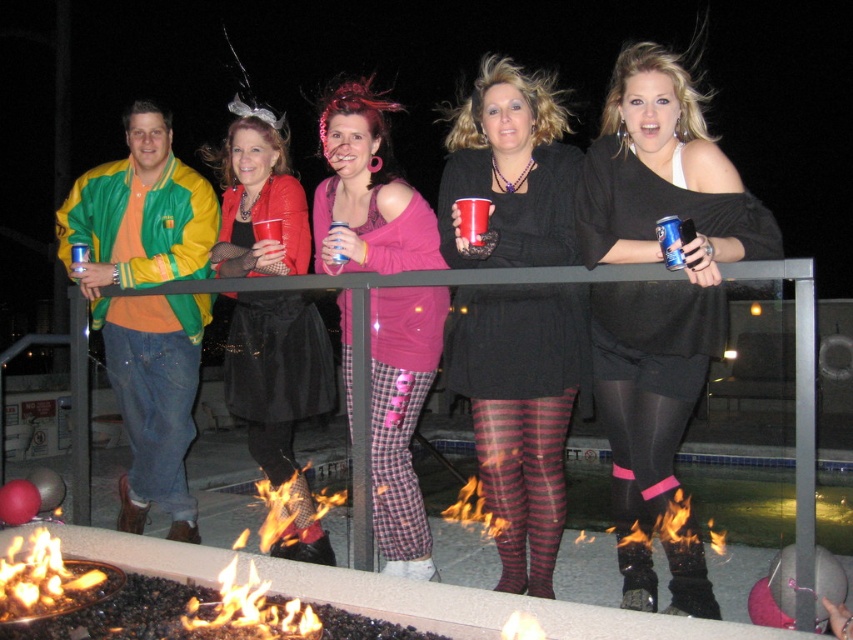
You are a photographer at the event and want to capture a photo of the matte black dress at center without the black matte boots at center appearing in the foreground. Is this possible based on their positions?

The black matte boots at center are located below the matte black dress at center, so if you position the camera to focus on the dress and avoid the lower area where the boots are, it should be possible to exclude the boots from the foreground.

You are taking a photo of the two points in the scene. Which point, point (132, 516) or point (442, 288), will appear larger in your photo?

Point (132, 516) is further to the camera than point (442, 288), so it will appear larger in the photo.